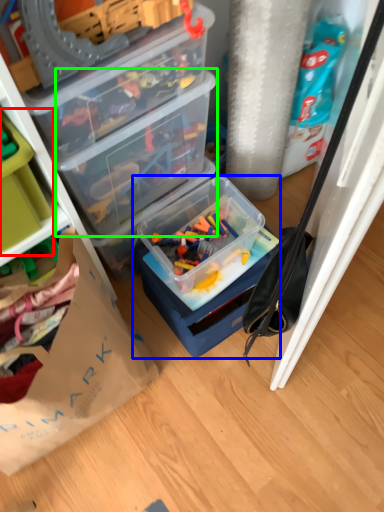
Question: Which object is positioned closest to storage box (highlighted by a red box)? Select from box (highlighted by a blue box) and box (highlighted by a green box).

Choices:
 (A) box
 (B) box

Answer: (B)